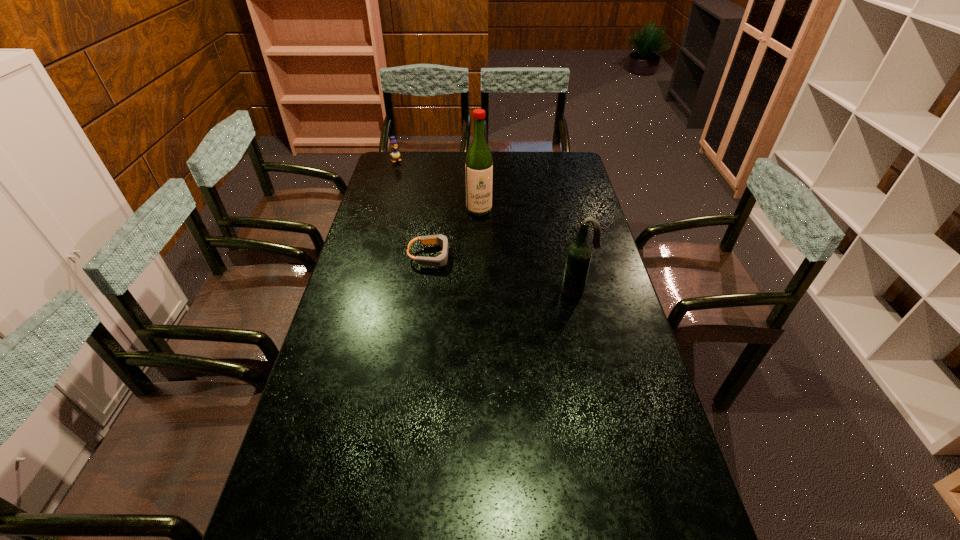
At what (x,y) coordinates should I click in order to perform the action: click on free point between the third object from right to left and the tallest object. Please return your answer as a coordinate pair (x, y). The width and height of the screenshot is (960, 540). Looking at the image, I should click on (455, 233).

This screenshot has height=540, width=960. I want to click on vacant area that lies between the second object from left to right and the beer bottle, so click(504, 274).

At what (x,y) coordinates should I click in order to perform the action: click on empty space that is in between the second shortest object and the shortest object. Please return your answer as a coordinate pair (x, y). Image resolution: width=960 pixels, height=540 pixels. Looking at the image, I should click on (414, 208).

I want to click on free space between the third tallest object and the third object from left to right, so click(438, 185).

What are the coordinates of `unoccupied area between the tallest object and the second tallest object` in the screenshot? It's located at (528, 251).

Identify the location of object that can be found as the third closest to the beer bottle. The height and width of the screenshot is (540, 960). (395, 154).

Choose which object is the second nearest neighbor to the third farthest object. Please provide its 2D coordinates. Your answer should be formatted as a tuple, i.e. [(x, y)], where the tuple contains the x and y coordinates of a point satisfying the conditions above.

[(579, 253)]

Identify the location of vacant space that satisfies the following two spatial constraints: 1. on the front side of the farthest object; 2. on the left side of the second tallest object. The width and height of the screenshot is (960, 540). (359, 292).

You are a GUI agent. You are given a task and a screenshot of the screen. Output one action in this format:
    pyautogui.click(x=<x>, y=<y>)
    Task: Click on the vacant region that satisfies the following two spatial constraints: 1. on the front side of the tallest object; 2. on the left side of the rightmost object
    The width and height of the screenshot is (960, 540).
    Given the screenshot: What is the action you would take?
    pyautogui.click(x=479, y=292)

Where is `free location that satisfies the following two spatial constraints: 1. on the front side of the leftmost object; 2. on the front and back of the shortest object`? The width and height of the screenshot is (960, 540). free location that satisfies the following two spatial constraints: 1. on the front side of the leftmost object; 2. on the front and back of the shortest object is located at coordinates (370, 256).